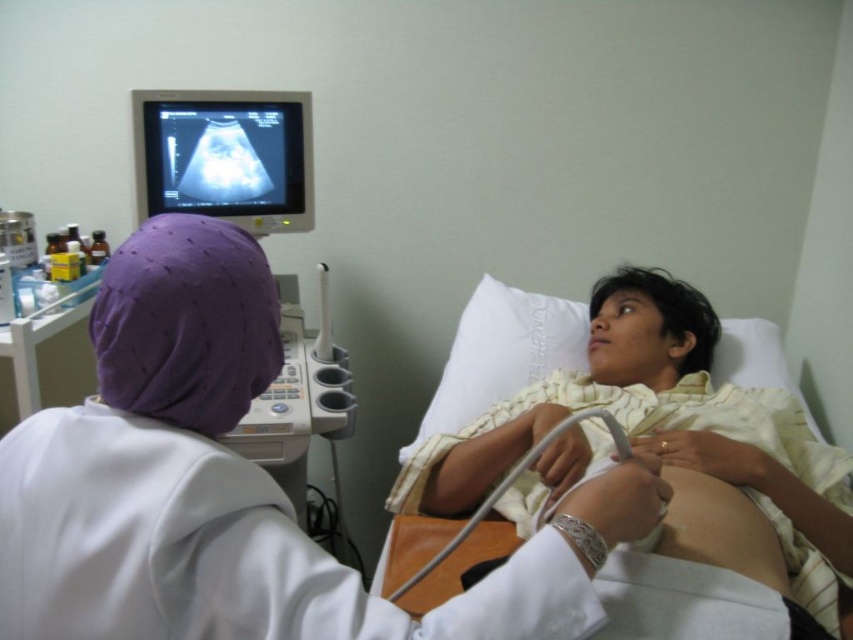
Question: Which of these objects is positioned farthest from the white fabric hospital bed at center?

Choices:
 (A) gray rubber ultrasound probe at lower center
 (B) matte black monitor at upper left
 (C) white matte lab coat at center

Answer: (B)

Question: Does white fabric hospital bed at center appear under gray rubber ultrasound probe at lower center?

Choices:
 (A) yes
 (B) no

Answer: (B)

Question: Which of the following is the farthest from the observer?

Choices:
 (A) white fabric hospital bed at center
 (B) white matte lab coat at center
 (C) matte black monitor at upper left
 (D) gray rubber ultrasound probe at lower center

Answer: (C)

Question: Can you confirm if matte black monitor at upper left is smaller than gray rubber ultrasound probe at lower center?

Choices:
 (A) yes
 (B) no

Answer: (A)

Question: Estimate the real-world distances between objects in this image. Which object is farther from the white matte lab coat at center?

Choices:
 (A) matte black monitor at upper left
 (B) white fabric hospital bed at center

Answer: (A)

Question: Can you confirm if white matte lab coat at center is positioned to the right of matte black monitor at upper left?

Choices:
 (A) yes
 (B) no

Answer: (A)